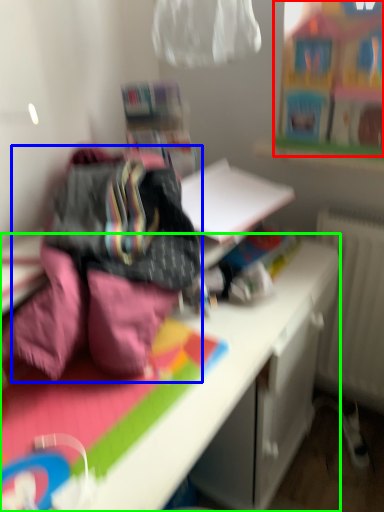
Question: Considering the real-world distances, which object is closest to toy (highlighted by a red box)? bedding (highlighted by a blue box) or desk (highlighted by a green box).

Choices:
 (A) bedding
 (B) desk

Answer: (B)